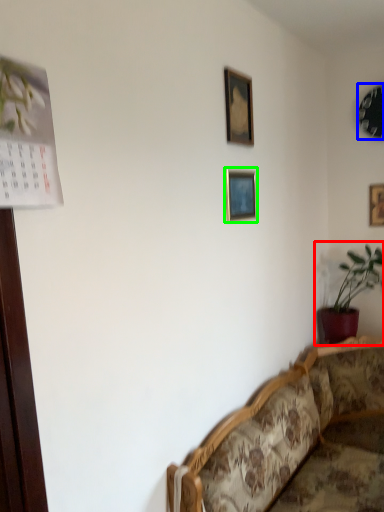
Question: Considering the real-world distances, which object is farthest from houseplant (highlighted by a red box)? picture frame (highlighted by a blue box) or picture frame (highlighted by a green box)?

Choices:
 (A) picture frame
 (B) picture frame

Answer: (B)